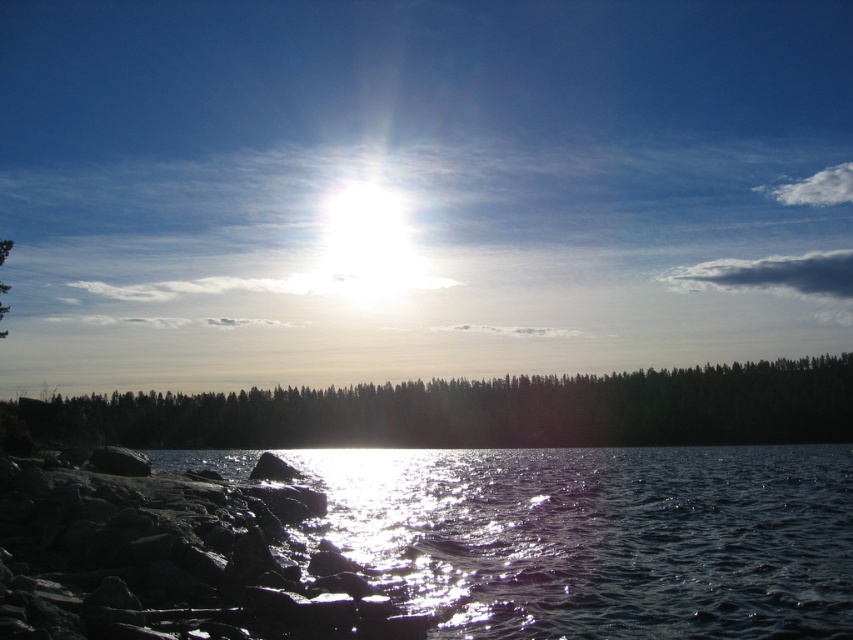
The width and height of the screenshot is (853, 640). What do you see at coordinates (173, 561) in the screenshot? I see `smooth gray rock at lower left` at bounding box center [173, 561].

Does smooth gray rock at lower left appear on the right side of green matte tree at left?

Yes, smooth gray rock at lower left is to the right of green matte tree at left.

This screenshot has height=640, width=853. Describe the element at coordinates (173, 561) in the screenshot. I see `smooth gray rock at lower left` at that location.

Locate an element on the screen. The image size is (853, 640). smooth gray rock at lower left is located at coordinates (173, 561).

Who is taller, glistening water at lower left or green matte tree at left?

glistening water at lower left is taller.

Can you confirm if glistening water at lower left is smaller than green matte tree at left?

No.

Where is `glistening water at lower left`? The width and height of the screenshot is (853, 640). glistening water at lower left is located at coordinates (596, 538).

Which of these two, dark green forest at center or green matte tree at left, stands shorter?

green matte tree at left

Does dark green forest at center lie in front of green matte tree at left?

Yes, it is in front of green matte tree at left.

Which is in front, point (824, 401) or point (3, 285)?

Point (3, 285)

You are a GUI agent. You are given a task and a screenshot of the screen. Output one action in this format:
    pyautogui.click(x=<x>, y=<y>)
    Task: Click on the dark green forest at center
    The height and width of the screenshot is (640, 853).
    Given the screenshot: What is the action you would take?
    pyautogui.click(x=467, y=412)